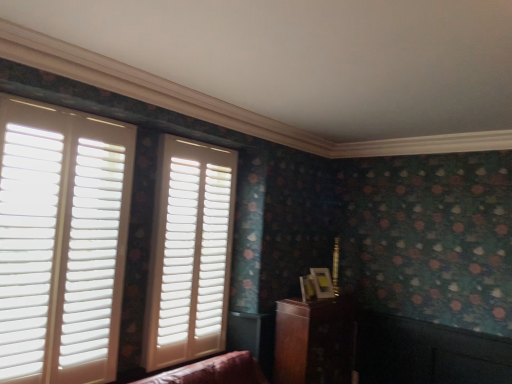
Question: From the image's perspective, is white matte shutters at left, placed as the 2th window when sorted from right to left, under white matte shutters at center, which appears as the 1th window when viewed from the back?

Choices:
 (A) yes
 (B) no

Answer: (B)

Question: Can we say white matte shutters at left, the 1th window in the left-to-right sequence, lies outside white matte shutters at center, which is counted as the first window, starting from the right?

Choices:
 (A) no
 (B) yes

Answer: (B)

Question: Does white matte shutters at left, placed as the 2th window when sorted from right to left, have a lesser height compared to white matte shutters at center, positioned as the second window in left-to-right order?

Choices:
 (A) yes
 (B) no

Answer: (A)

Question: Does white matte shutters at left, the 1th window in the left-to-right sequence, have a smaller size compared to white matte shutters at center, which is counted as the first window, starting from the right?

Choices:
 (A) yes
 (B) no

Answer: (B)

Question: Considering the relative positions of white matte shutters at left, placed as the 2th window when sorted from back to front, and white matte shutters at center, arranged as the 2th window when viewed from the front, in the image provided, is white matte shutters at left, placed as the 2th window when sorted from back to front, behind white matte shutters at center, arranged as the 2th window when viewed from the front,?

Choices:
 (A) no
 (B) yes

Answer: (A)

Question: From the image's perspective, is white matte shutters at left, placed as the 2th window when sorted from back to front, located above white matte shutters at center, positioned as the second window in left-to-right order?

Choices:
 (A) no
 (B) yes

Answer: (B)

Question: Does wooden cabinet at lower right come in front of white matte shutters at center, which is counted as the first window, starting from the right?

Choices:
 (A) no
 (B) yes

Answer: (A)

Question: Is the position of wooden cabinet at lower right more distant than that of white matte shutters at center, which is counted as the first window, starting from the right?

Choices:
 (A) no
 (B) yes

Answer: (B)

Question: From the image's perspective, is wooden cabinet at lower right on top of white matte shutters at center, arranged as the 2th window when viewed from the front?

Choices:
 (A) yes
 (B) no

Answer: (B)

Question: Is wooden cabinet at lower right wider than white matte shutters at center, which is counted as the first window, starting from the right?

Choices:
 (A) yes
 (B) no

Answer: (A)

Question: From a real-world perspective, is wooden cabinet at lower right located higher than white matte shutters at center, positioned as the second window in left-to-right order?

Choices:
 (A) no
 (B) yes

Answer: (A)

Question: Is wooden cabinet at lower right turned away from white matte shutters at center, which appears as the 1th window when viewed from the back?

Choices:
 (A) yes
 (B) no

Answer: (B)

Question: Is white matte shutters at center, arranged as the 2th window when viewed from the front, far away from wooden cabinet at lower right?

Choices:
 (A) no
 (B) yes

Answer: (A)